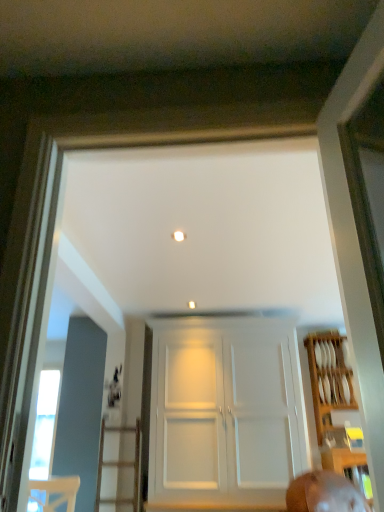
Question: From their relative heights in the image, would you say wooden plate rack at right is taller or shorter than white matte door at center?

Choices:
 (A) tall
 (B) short

Answer: (B)

Question: Would you say wooden plate rack at right is inside or outside white matte door at center?

Choices:
 (A) inside
 (B) outside

Answer: (B)

Question: Is point 309,372 closer or farther from the camera than point 254,393?

Choices:
 (A) farther
 (B) closer

Answer: (A)

Question: From a real-world perspective, is white matte door at center positioned above or below wooden plate rack at right?

Choices:
 (A) above
 (B) below

Answer: (B)

Question: From their relative heights in the image, would you say white matte door at center is taller or shorter than wooden plate rack at right?

Choices:
 (A) tall
 (B) short

Answer: (A)

Question: In terms of width, does white matte door at center look wider or thinner when compared to wooden plate rack at right?

Choices:
 (A) thin
 (B) wide

Answer: (B)

Question: Based on their sizes in the image, would you say white matte door at center is bigger or smaller than wooden plate rack at right?

Choices:
 (A) big
 (B) small

Answer: (A)